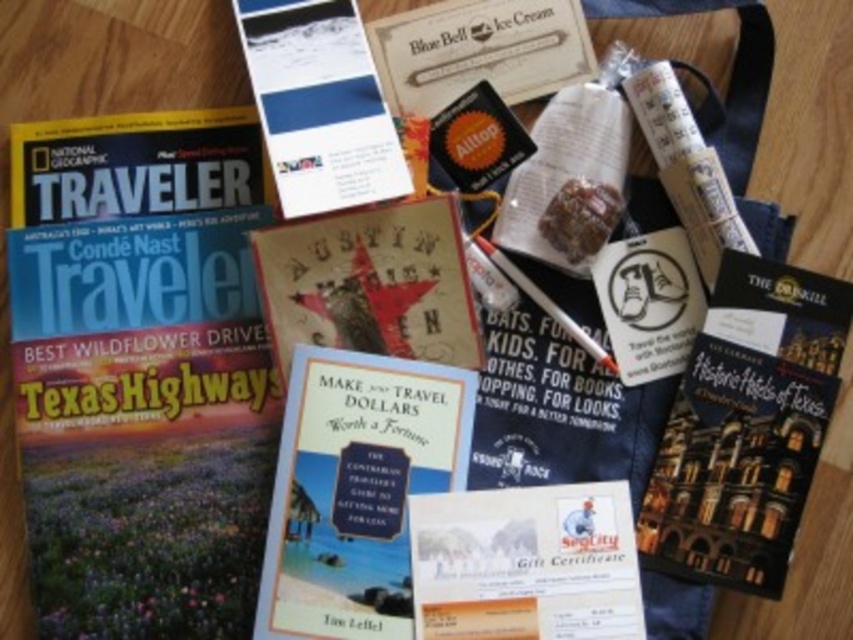
Consider the image. You are organizing a travel kit and need to place the matte paper brochure at upper center and the white matte pen at center into a small pouch. Which item should you place first to ensure both fit properly?

The matte paper brochure at upper center is positioned over the white matte pen at center, so you should place the white matte pen at center first to make space for the brochure on top.

You are preparing to write a message on the white paper gift certificate at center using the white matte pen at center. Will the pen fit comfortably on the certificate without overlapping the edges?

The white paper gift certificate at center is larger in size than the white matte pen at center, so the pen will fit comfortably on the certificate without overlapping the edges.

You are preparing to write a message on the white paper gift certificate at center using the white matte pen at center. However, you notice something might prevent you from doing so. What is the issue?

The white paper gift certificate at center is positioned under the white matte pen at center, so the pen is blocking access to the certificate, making it difficult to write on it.